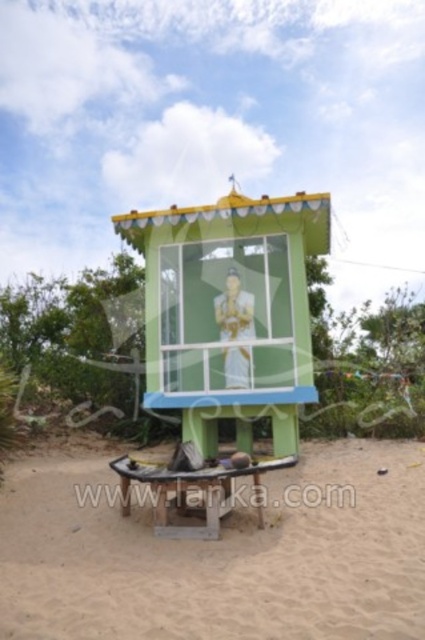
Question: Does green painted wood at center have a larger size compared to wooden picnic table at center?

Choices:
 (A) yes
 (B) no

Answer: (A)

Question: Which point is closer to the camera?

Choices:
 (A) wooden picnic table at center
 (B) sandy brown sand at lower center
 (C) green painted wood at center

Answer: (B)

Question: Which point is farther to the camera?

Choices:
 (A) click(x=413, y=508)
 (B) click(x=218, y=285)

Answer: (B)

Question: Is green painted wood at center thinner than wooden picnic table at center?

Choices:
 (A) no
 (B) yes

Answer: (A)

Question: Does green painted wood at center have a greater width compared to wooden picnic table at center?

Choices:
 (A) yes
 (B) no

Answer: (A)

Question: Which point is farther to the camera?

Choices:
 (A) (286, 243)
 (B) (261, 586)
 (C) (195, 524)

Answer: (A)